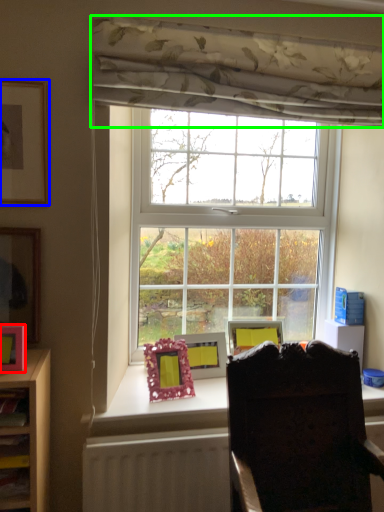
Question: Estimate the real-world distances between objects in this image. Which object is closer to picture frame (highlighted by a red box), picture frame (highlighted by a blue box) or curtain (highlighted by a green box)?

Choices:
 (A) picture frame
 (B) curtain

Answer: (A)